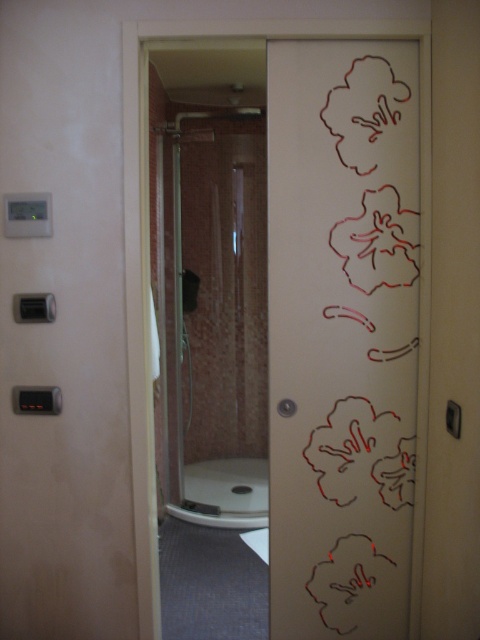
Question: Where is transparent glass door at right located in relation to clear glass shower at center in the image?

Choices:
 (A) right
 (B) left

Answer: (A)

Question: Does transparent glass door at right have a lesser width compared to clear glass shower at center?

Choices:
 (A) yes
 (B) no

Answer: (A)

Question: Is transparent glass door at right positioned in front of clear glass shower at center?

Choices:
 (A) no
 (B) yes

Answer: (B)

Question: Which of the following is the closest to the observer?

Choices:
 (A) transparent glass door at right
 (B) clear glass shower at center

Answer: (A)

Question: Which point is farther from the camera taking this photo?

Choices:
 (A) (182, 125)
 (B) (298, 636)

Answer: (A)

Question: Which object is farther from the camera taking this photo?

Choices:
 (A) clear glass shower at center
 (B) transparent glass door at right

Answer: (A)